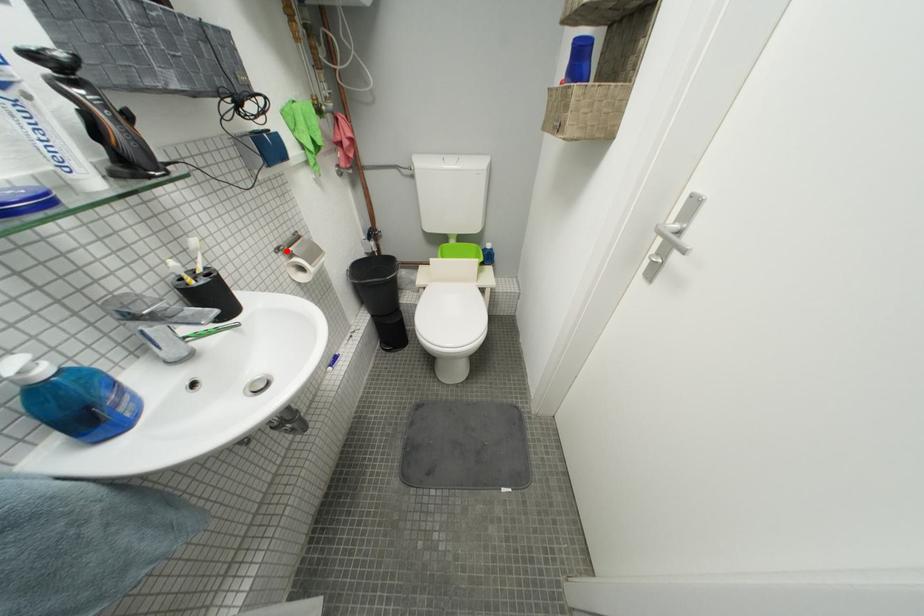
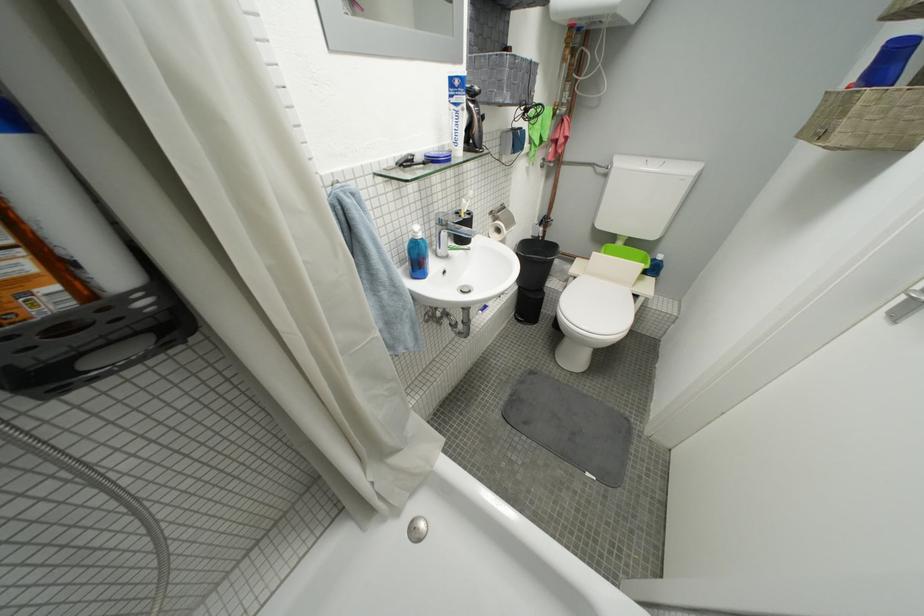
Locate, in the second image, the point that corresponds to the highlighted location in the first image.

(500, 214)